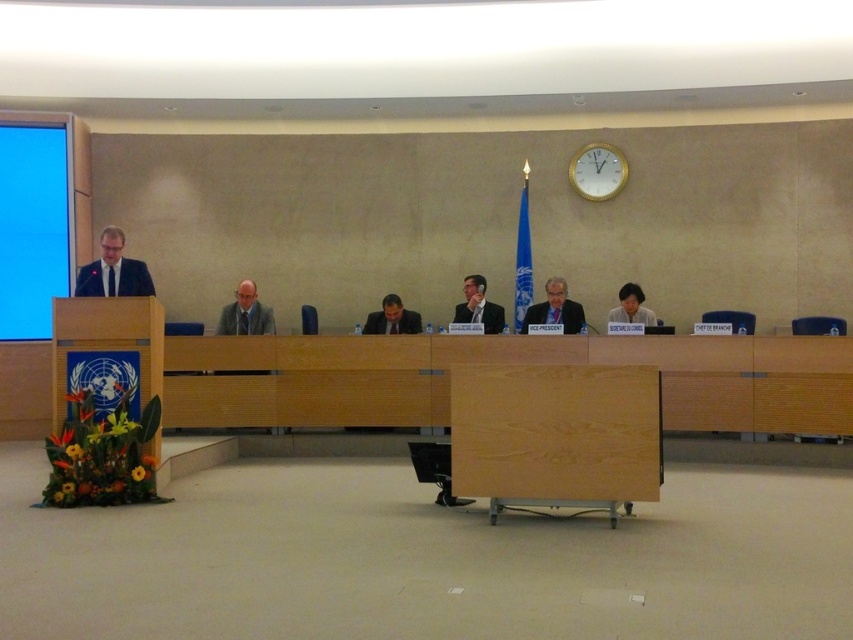
You are attending a meeting in this room and need to present a document from your laptop. The gray fabric suit at center is the chairperson. Can you easily access the matte black laptop at lower right without disturbing them?

The matte black laptop at lower right is behind the gray fabric suit at center, so you would need to go around or ask the chairperson to move to access it, making it difficult to do so without disturbance.

You are a service robot in a conference room. You need to deliver a document to the person wearing the gray fabric suit at center. You are currently positioned near the matte black laptop at lower right. Can you reach the person without moving more than 5 meters?

The distance between the gray fabric suit at center and the matte black laptop at lower right is 4.51 meters, so yes, the robot can reach the person wearing the gray fabric suit at center without exceeding the 5 meter limit.

You are a photographer standing behind the podium and want to take a photo of the matte black suit at left and the black suit at center. Can you fit both subjects into the frame if your camera has a maximum horizontal field of view of 4 meters?

The distance between the matte black suit at left and the black suit at center is 4.15 meters, which exceeds the camera field of view of 4 meters. Therefore, both subjects cannot be captured in a single frame.